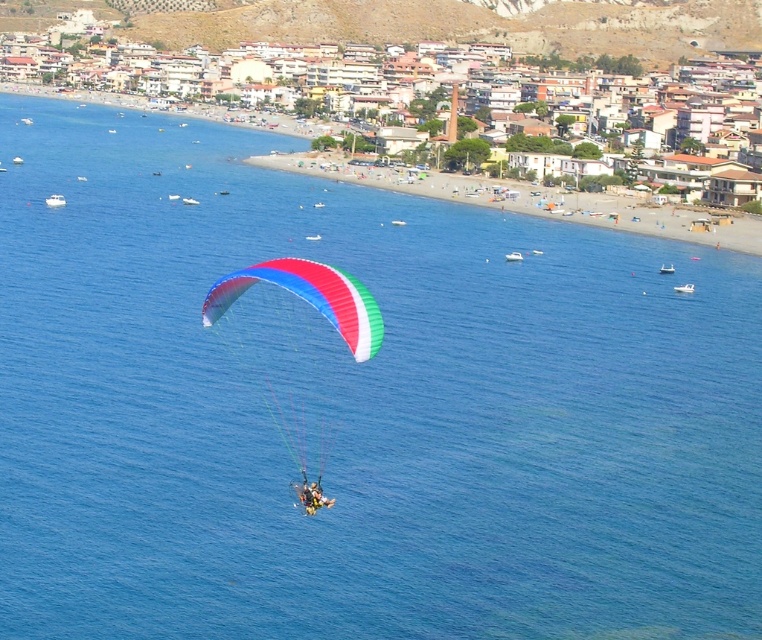
You are a photographer capturing the paragliders from the beach. You have two paragliders in view, the multicolored fabric parachute at center and the yellow fabric parachute at center. Which one appears taller in the sky?

The multicolored fabric parachute at center appears taller than the yellow fabric parachute at center in the sky.

You are a photographer trying to capture the paragliders in the image. Which parachute is more to the left, the multicolored fabric parachute at center or the yellow fabric parachute at center?

The multicolored fabric parachute at center is more to the left because it is positioned on the left side of the yellow fabric parachute at center.

You are a photographer trying to capture the paragliders in the sky. You notice two parachutes, the multicolored fabric parachute at center and the yellow fabric parachute at center. Which one would appear closer to you?

The multicolored fabric parachute at center appears closer because the yellow fabric parachute at center is positioned behind it.